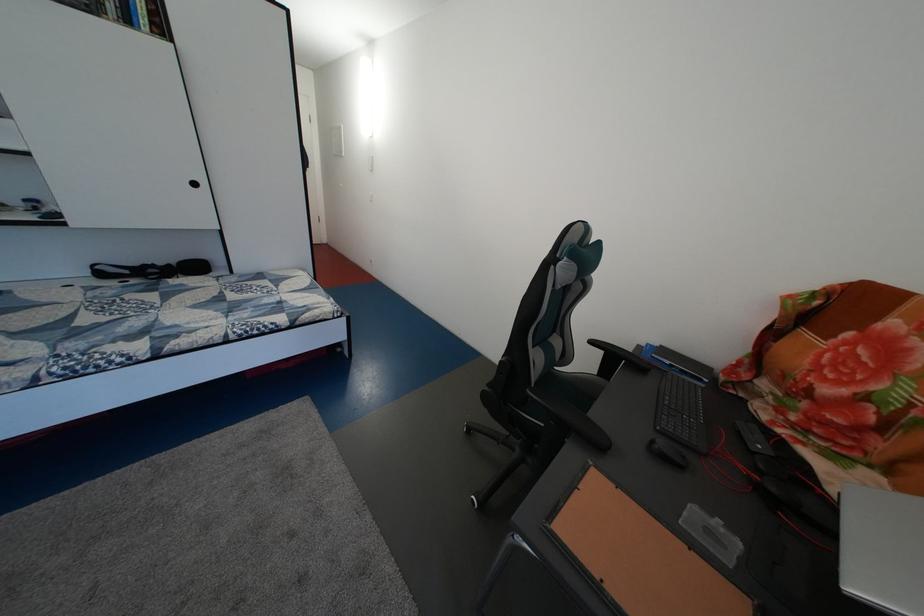
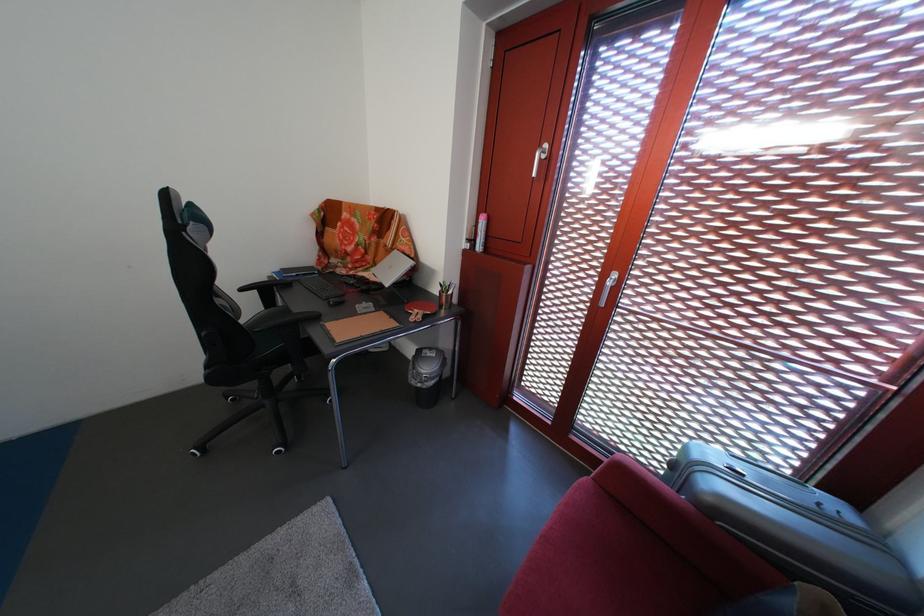
In the second image, find the point that corresponds to [617,376] in the first image.

(280, 308)